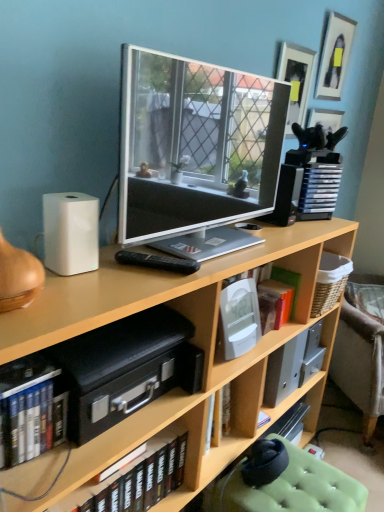
At what (x,y) coordinates should I click in order to perform the action: click on space that is in front of white plastic speaker at right, which is the second speaker in bottom-to-top order. Please return your answer as a coordinate pair (x, y). The height and width of the screenshot is (512, 384). Looking at the image, I should click on (289, 230).